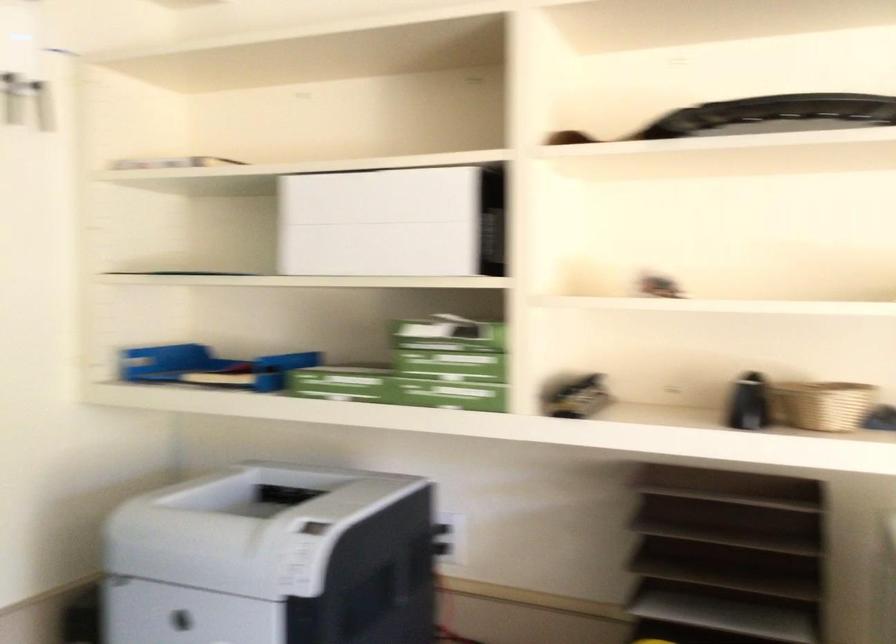
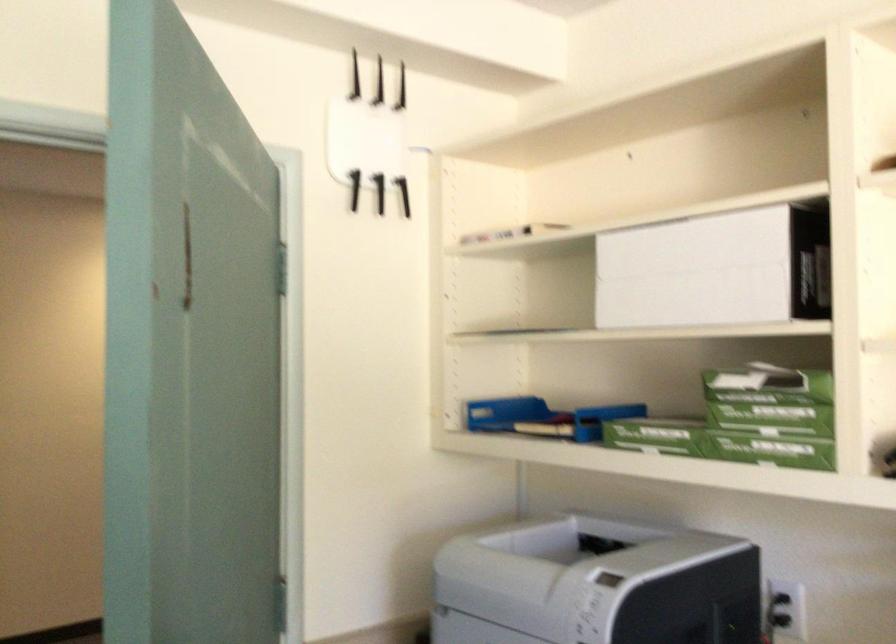
Find the pixel in the second image that matches point (453, 362) in the first image.

(769, 420)